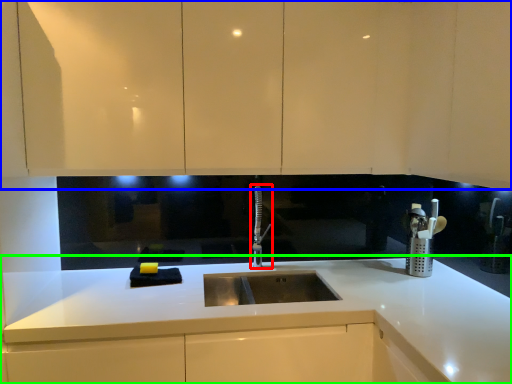
Question: Estimate the real-world distances between objects in this image. Which object is farther from tap (highlighted by a red box), cabinetry (highlighted by a blue box) or countertop (highlighted by a green box)?

Choices:
 (A) cabinetry
 (B) countertop

Answer: (A)